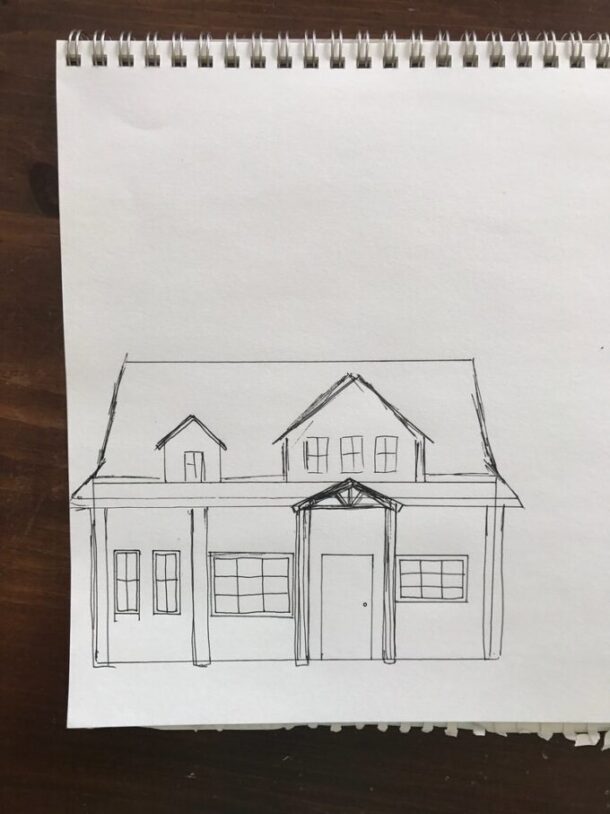
At what (x,y) coordinates should I click in order to perform the action: click on door. Please return your answer as a coordinate pair (x, y). Looking at the image, I should click on (352, 606).